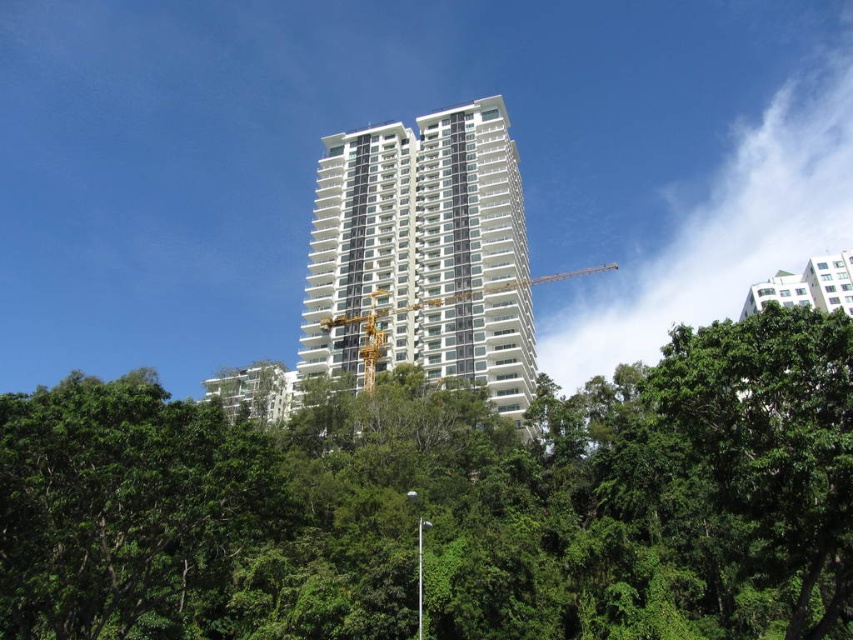
Measure the distance between point (x=494, y=324) and camera.

Point (x=494, y=324) is 85.65 meters from camera.

Who is positioned more to the right, white glossy building at center or yellow metallic crane at center?

Positioned to the right is yellow metallic crane at center.

Is point (419, 256) behind point (370, 317)?

Yes, it is behind point (370, 317).

In order to click on white glossy building at center in this screenshot , I will do `click(424, 253)`.

Can you confirm if green leafy tree at center is taller than yellow metallic crane at center?

In fact, green leafy tree at center may be shorter than yellow metallic crane at center.

Does green leafy tree at center appear under yellow metallic crane at center?

Correct, green leafy tree at center is located below yellow metallic crane at center.

Find the location of `green leafy tree at center`. green leafy tree at center is located at coordinates (448, 506).

Is green leafy tree at center positioned behind white glossy building at center?

No, green leafy tree at center is closer to the viewer.

What do you see at coordinates (448, 506) in the screenshot? I see `green leafy tree at center` at bounding box center [448, 506].

Is point (682, 496) closer to camera compared to point (488, 244)?

Yes.

Identify the location of green leafy tree at center. (448, 506).